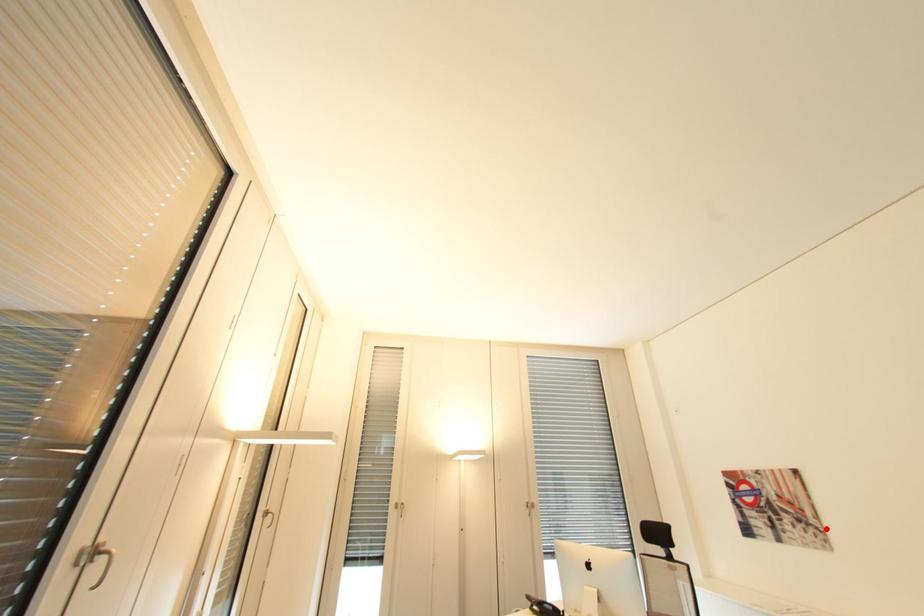
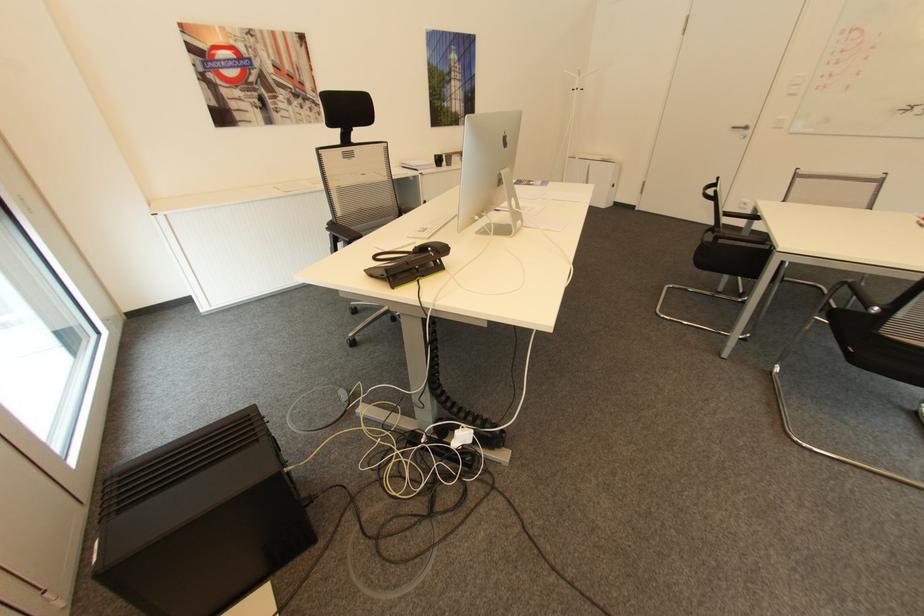
Question: I am providing you with two images of the same scene from different viewpoints. In image1, a red point is highlighted. Considering the same 3D point in image2, which of the following is correct?

Choices:
 (A) It is closer
 (B) It is farther

Answer: (B)